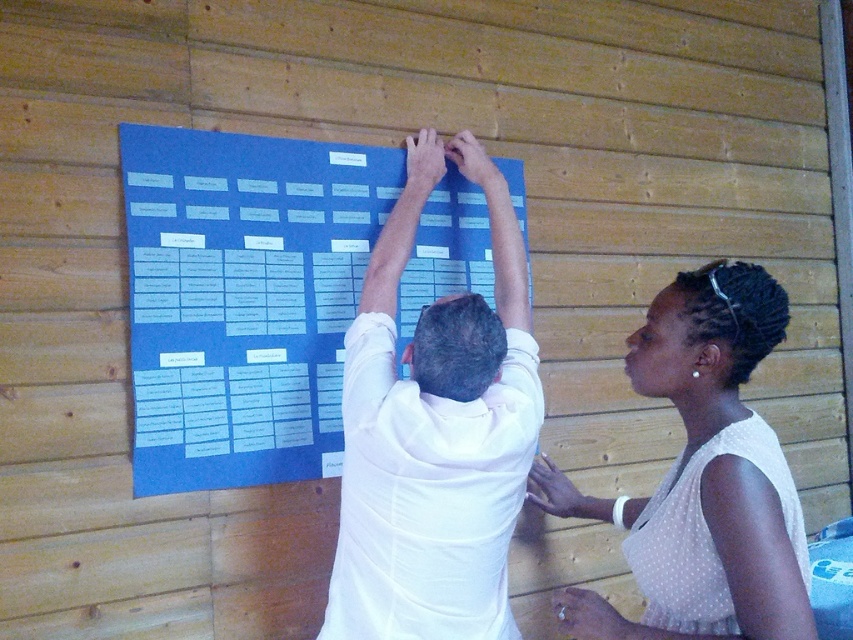
You are a delivery person who needs to place a small package on the blue paperboard at center. The package must be placed exactly at point (242,300). Can you confirm if this point is on the blue paperboard at center?

Yes, the point (242,300) is on the blue paperboard at center, so the package can be placed there.

You are standing in front of the blue paperboard at center and the white matte shirt at center. Which object is taller?

The white matte shirt at center is taller than the blue paperboard at center.

You are standing in front of the blue paperboard at center. You want to place a new sticky note on the board. If your arm can reach up to 5 feet, can you reach the top of the board?

The blue paperboard at center is 5.07 feet away from the viewer. Since your arm can reach up to 5 feet, you cannot reach the top of the blue paperboard at center because it is slightly farther than your arm length.